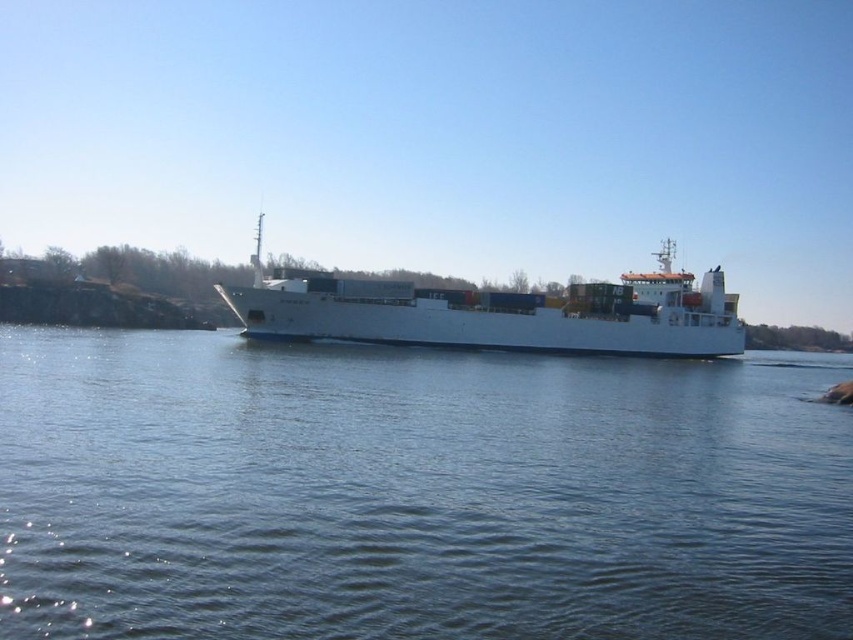
Question: In this image, where is blue water at center located relative to white matte container ship at center?

Choices:
 (A) left
 (B) right

Answer: (B)

Question: Which point is farther from the camera taking this photo?

Choices:
 (A) [264, 336]
 (B) [241, 435]

Answer: (A)

Question: Is blue water at center smaller than white matte container ship at center?

Choices:
 (A) yes
 (B) no

Answer: (A)

Question: Is blue water at center in front of white matte container ship at center?

Choices:
 (A) yes
 (B) no

Answer: (A)

Question: Which point is closer to the camera taking this photo?

Choices:
 (A) (776, 564)
 (B) (291, 316)

Answer: (A)